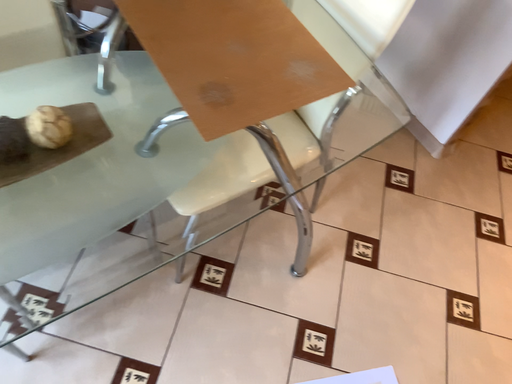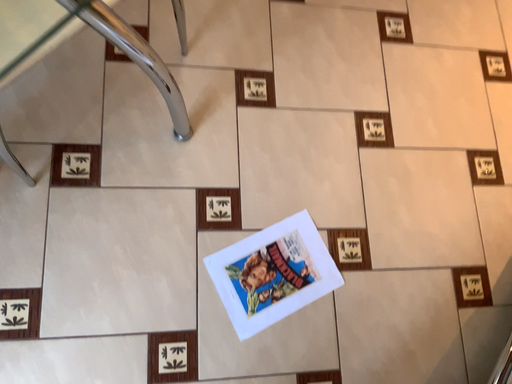
Question: Which way did the camera rotate in the video?

Choices:
 (A) rotated right
 (B) rotated left

Answer: (A)